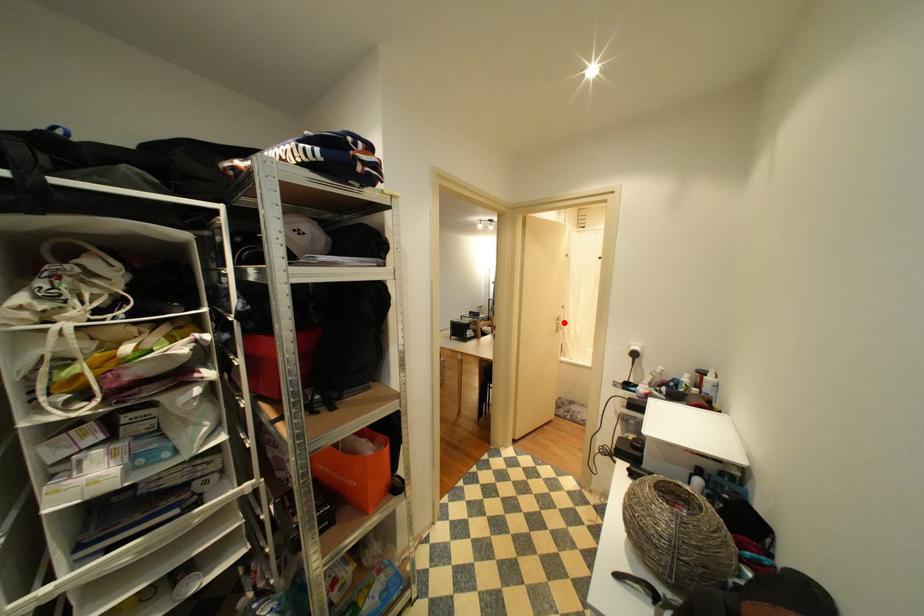
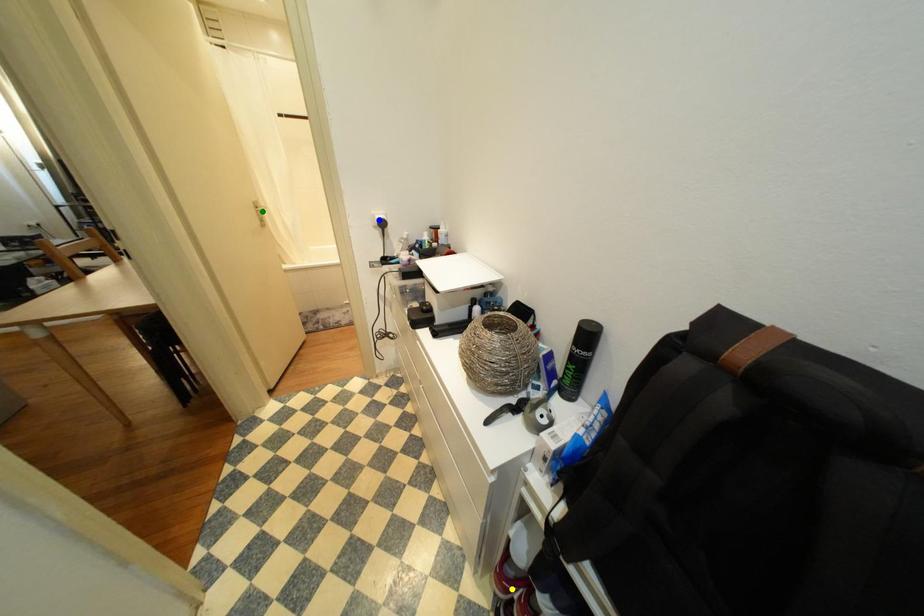
Question: I am providing you with two images of the same scene from different viewpoints. A red point is marked on the first image. You are given multiple points on the second image. Can you choose the point in image 2 that corresponds to the point in image 1?

Choices:
 (A) green point
 (B) yellow point
 (C) blue point

Answer: (A)